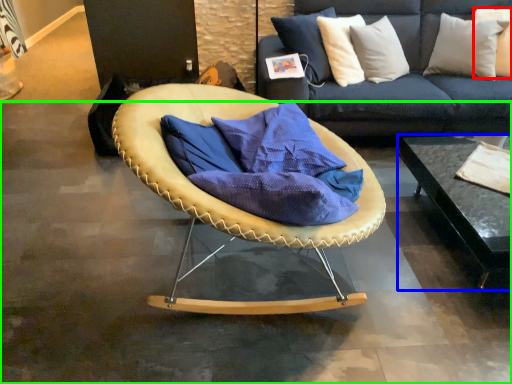
Question: Considering the real-world distances, which object is closest to pillow (highlighted by a red box)? table (highlighted by a blue box) or concrete (highlighted by a green box).

Choices:
 (A) table
 (B) concrete

Answer: (A)